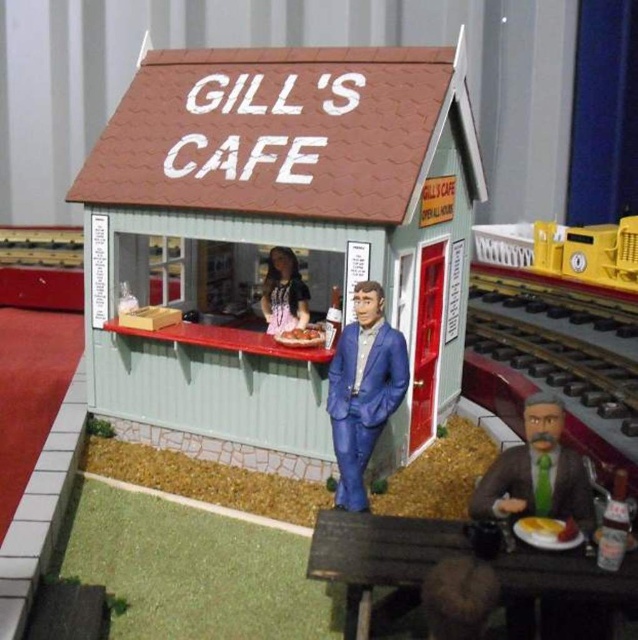
Question: Does green corrugated metal hut at center come behind matte black dress at center?

Choices:
 (A) yes
 (B) no

Answer: (B)

Question: Which object is the closest to the yellow plastic train at right?

Choices:
 (A) green corrugated metal hut at center
 (B) green fabric suit at lower right
 (C) matte black dress at center
 (D) blue plastic figure at center

Answer: (A)

Question: Which object appears farthest from the camera in this image?

Choices:
 (A) yellow plastic train at right
 (B) green fabric suit at lower right
 (C) green corrugated metal hut at center
 (D) blue plastic figure at center

Answer: (A)

Question: Considering the relative positions of green fabric suit at lower right and blue plastic figure at center in the image provided, where is green fabric suit at lower right located with respect to blue plastic figure at center?

Choices:
 (A) below
 (B) above

Answer: (A)

Question: Estimate the real-world distances between objects in this image. Which object is farther from the matte black dress at center?

Choices:
 (A) blue plastic figure at center
 (B) yellow plastic train at right
 (C) green corrugated metal hut at center

Answer: (B)

Question: Can you confirm if green corrugated metal hut at center is positioned below yellow plastic train at right?

Choices:
 (A) no
 (B) yes

Answer: (A)